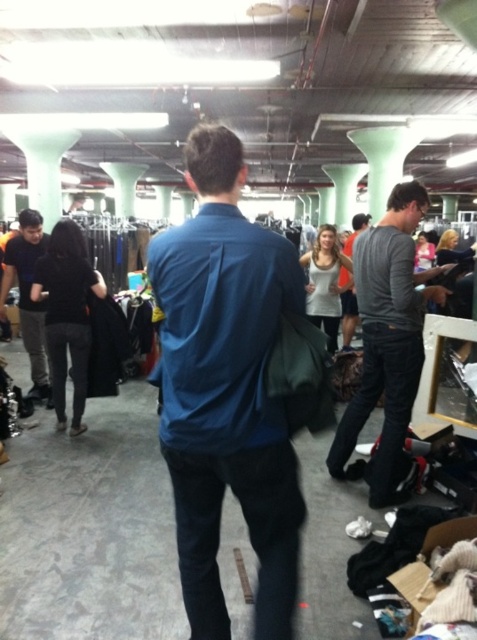
You are organizing a clothing display and need to place the blue smooth shirt at center and the gray cotton shirt at right. Which shirt should be placed on the smaller hanger?

The blue smooth shirt at center has a smaller size compared to the gray cotton shirt at right, so it should be placed on the smaller hanger.

You are organizing a clothing display and need to place the blue smooth shirt at center and the gray cotton shirt at right on adjacent hangers. Which shirt requires a wider hanger to accommodate its width?

The gray cotton shirt at right requires a wider hanger because its width is greater than the blue smooth shirt at center.